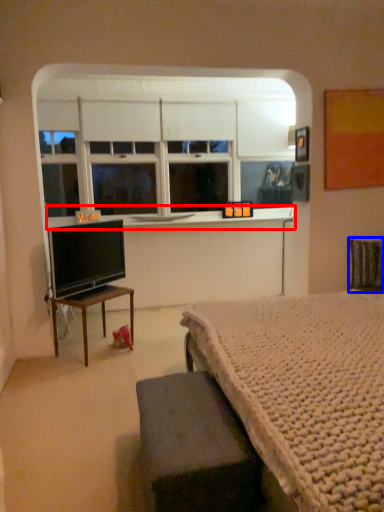
Question: Which point is further to the camera, window sill (highlighted by a red box) or swivel chair (highlighted by a blue box)?

Choices:
 (A) window sill
 (B) swivel chair

Answer: (A)